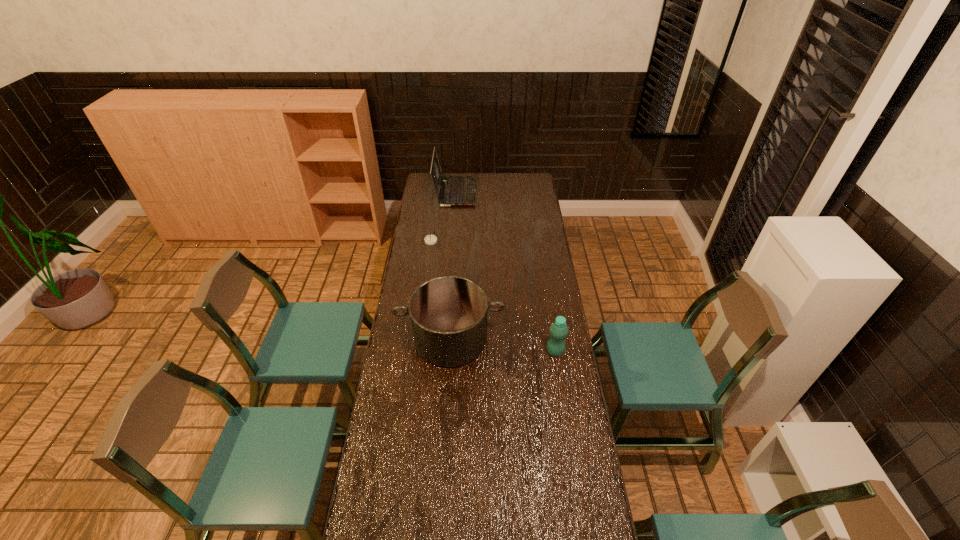
Locate an element on the screen. the third closest object to the laptop computer is located at coordinates (559, 330).

Select which object is the second closest to the laptop computer. Please provide its 2D coordinates. Your answer should be formatted as a tuple, i.e. [(x, y)], where the tuple contains the x and y coordinates of a point satisfying the conditions above.

[(448, 314)]

Locate an element on the screen. The image size is (960, 540). vacant space that satisfies the following two spatial constraints: 1. on the screen of the laptop computer; 2. on the back side of the pan is located at coordinates (444, 339).

This screenshot has height=540, width=960. I want to click on free location that satisfies the following two spatial constraints: 1. on the screen of the farthest object; 2. on the right side of the pan, so click(444, 339).

Locate an element on the screen. The height and width of the screenshot is (540, 960). free spot that satisfies the following two spatial constraints: 1. on the screen of the laptop computer; 2. on the front side of the compass is located at coordinates (451, 241).

You are a GUI agent. You are given a task and a screenshot of the screen. Output one action in this format:
    pyautogui.click(x=<x>, y=<y>)
    Task: Click on the free space that satisfies the following two spatial constraints: 1. on the front side of the compass; 2. on the right side of the pan
    This screenshot has width=960, height=540.
    Given the screenshot: What is the action you would take?
    pyautogui.click(x=419, y=339)